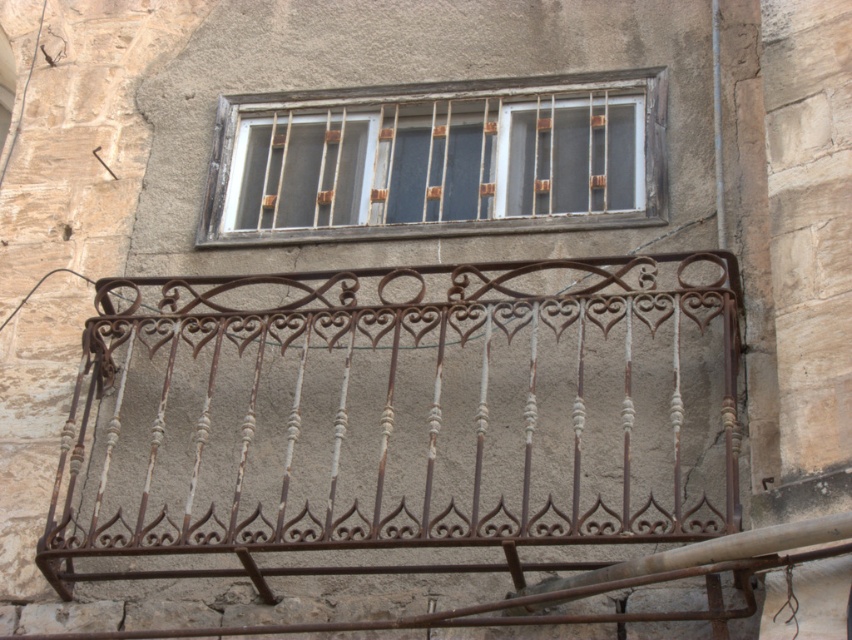
You are standing on the ground floor of an old building and see the rusty wrought iron balcony at center above you. If you want to throw a small ball upwards to hit the balcony, will you be able to reach it?

The rusty wrought iron balcony at center is 25.86 meters away from the viewer. Since the average throwing distance for a small ball is much shorter than 25.86 meters, you will not be able to reach the balcony with a throw.

You are an architect inspecting the building. You notice the rusty wrought iron balcony at center and the wooden bars at upper center. Which structure requires more immediate attention due to its size and potential structural risks?

The rusty wrought iron balcony at center requires more immediate attention because it is larger in size than the wooden bars at upper center, making it more vulnerable to structural issues caused by rust and aging.